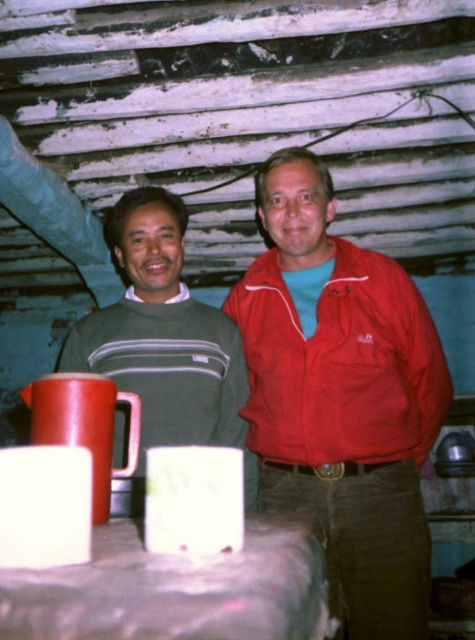
Question: Estimate the real-world distances between objects in this image. Which object is closer to the white matte mug at center?

Choices:
 (A) matte green sweater at center
 (B) matte red mug at center
 (C) red matte jacket at center
 (D) matte red jacket at center

Answer: (B)

Question: Which object is closer to the camera taking this photo?

Choices:
 (A) red matte jacket at center
 (B) matte red jacket at center
 (C) matte red mug at center
 (D) matte red mug at lower left

Answer: (C)

Question: Is red matte jacket at center above matte red mug at center?

Choices:
 (A) no
 (B) yes

Answer: (B)

Question: Is red matte jacket at center to the right of matte red mug at lower left from the viewer's perspective?

Choices:
 (A) yes
 (B) no

Answer: (A)

Question: Is white matte mug at center wider than matte red mug at lower left?

Choices:
 (A) yes
 (B) no

Answer: (B)

Question: Which point is farther to the camera?

Choices:
 (A) matte red mug at lower left
 (B) matte red mug at center
 (C) matte green sweater at center

Answer: (C)